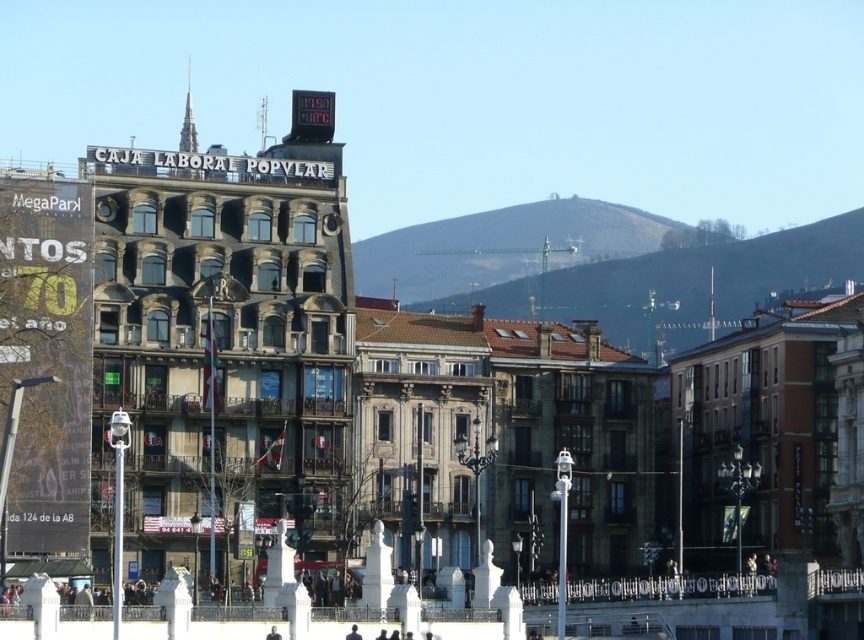
Between metallic digital clock at center and dark brown leather jacket at center, which one is positioned higher?

Positioned higher is metallic digital clock at center.

Measure the distance between metallic digital clock at center and dark brown leather jacket at center.

metallic digital clock at center and dark brown leather jacket at center are 35.49 meters apart.

The width and height of the screenshot is (864, 640). In order to click on metallic digital clock at center in this screenshot , I will do `click(331, 224)`.

Is metallic digital clock at center wider than dark blue suit at center?

Yes, metallic digital clock at center is wider than dark blue suit at center.

Which of these two, metallic digital clock at center or dark blue suit at center, stands taller?

Standing taller between the two is metallic digital clock at center.

Is point (327, 230) behind point (354, 625)?

Yes.

Locate an element on the screen. metallic digital clock at center is located at coordinates (331, 224).

Can you confirm if dark blue suit at center is positioned to the left of dark brown leather jacket at center?

No, dark blue suit at center is not to the left of dark brown leather jacket at center.

Is dark blue suit at center below dark brown leather jacket at center?

Yes, dark blue suit at center is below dark brown leather jacket at center.

Is point (354, 637) more distant than point (269, 636)?

Yes, it is.

At what (x,y) coordinates should I click in order to perform the action: click on dark blue suit at center. Please return your answer as a coordinate pair (x, y). Looking at the image, I should click on (353, 634).